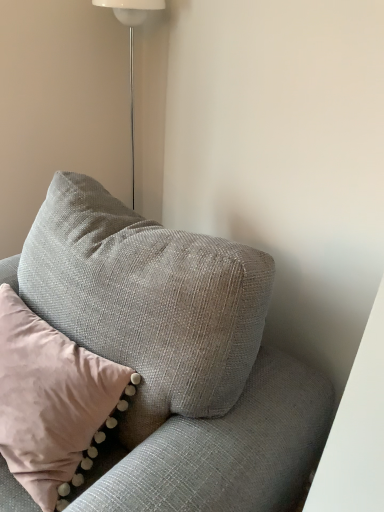
Question: Is textured gray pillow at upper left located within textured gray couch at upper right?

Choices:
 (A) no
 (B) yes

Answer: (B)

Question: Is textured gray couch at upper right in contact with textured gray pillow at upper left?

Choices:
 (A) no
 (B) yes

Answer: (A)

Question: Does textured gray couch at upper right appear on the right side of textured gray pillow at upper left?

Choices:
 (A) no
 (B) yes

Answer: (B)

Question: From a real-world perspective, is textured gray couch at upper right positioned under textured gray pillow at upper left based on gravity?

Choices:
 (A) yes
 (B) no

Answer: (A)

Question: Is textured gray couch at upper right smaller than textured gray pillow at upper left?

Choices:
 (A) no
 (B) yes

Answer: (A)

Question: Considering the relative sizes of textured gray couch at upper right and textured gray pillow at upper left in the image provided, is textured gray couch at upper right bigger than textured gray pillow at upper left?

Choices:
 (A) no
 (B) yes

Answer: (B)

Question: Is textured gray couch at upper right surrounding white glossy floor lamp at upper center?

Choices:
 (A) yes
 (B) no

Answer: (B)

Question: Would you say textured gray couch at upper right is outside white glossy floor lamp at upper center?

Choices:
 (A) no
 (B) yes

Answer: (B)

Question: Is textured gray couch at upper right further to the viewer compared to white glossy floor lamp at upper center?

Choices:
 (A) no
 (B) yes

Answer: (A)

Question: From the image's perspective, is textured gray couch at upper right below white glossy floor lamp at upper center?

Choices:
 (A) yes
 (B) no

Answer: (A)

Question: Can you confirm if textured gray couch at upper right is smaller than white glossy floor lamp at upper center?

Choices:
 (A) yes
 (B) no

Answer: (B)

Question: Is textured gray couch at upper right facing away from white glossy floor lamp at upper center?

Choices:
 (A) yes
 (B) no

Answer: (B)

Question: Would you consider textured gray pillow at upper left to be distant from white glossy floor lamp at upper center?

Choices:
 (A) no
 (B) yes

Answer: (B)